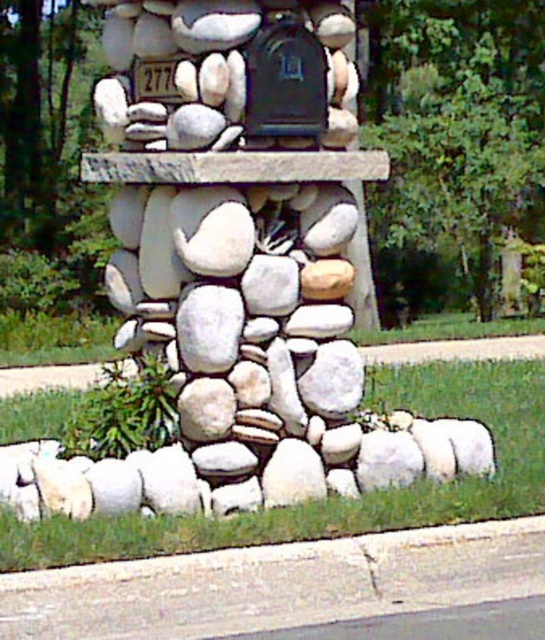
Between point (225, 45) and point (298, 548), which one is positioned behind?

The point (225, 45) is more distant.

Is white stone sculpture at center behind gray concrete curb at lower left?

Yes, it is.

Which is behind, point (110, 40) or point (221, 605)?

Positioned behind is point (110, 40).

You are a GUI agent. You are given a task and a screenshot of the screen. Output one action in this format:
    pyautogui.click(x=<x>, y=<y>)
    Task: Click on the white stone sculpture at center
    
    Given the screenshot: What is the action you would take?
    pyautogui.click(x=237, y=278)

Based on the photo, who is more forward, [458,580] or [308,92]?

Point [458,580] is more forward.

Is the position of gray concrete curb at lower left more distant than that of black matte mailbox at center?

No, gray concrete curb at lower left is closer to the viewer.

The height and width of the screenshot is (640, 545). Find the location of `gray concrete curb at lower left`. gray concrete curb at lower left is located at coordinates (276, 582).

Image resolution: width=545 pixels, height=640 pixels. Identify the location of gray concrete curb at lower left. (276, 582).

Between white stone sculpture at center and black matte mailbox at center, which one is positioned higher?

Positioned higher is black matte mailbox at center.

Who is taller, white stone sculpture at center or black matte mailbox at center?

Standing taller between the two is white stone sculpture at center.

Find the location of a particular element. Image resolution: width=545 pixels, height=640 pixels. white stone sculpture at center is located at coordinates (237, 278).